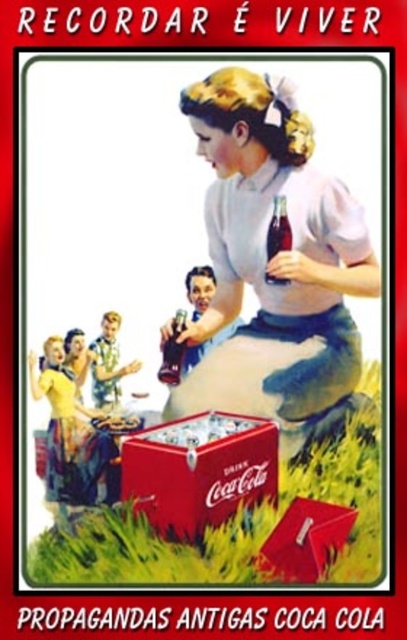
Question: Which is nearer to the yellow fabric dress at lower left?

Choices:
 (A) matte red cooler at lower center
 (B) matte white dress at center
 (C) matte red cooler at center

Answer: (A)

Question: Which point is farther to the camera?

Choices:
 (A) (273, 225)
 (B) (326, 561)

Answer: (A)

Question: Estimate the real-world distances between objects in this image. Which object is closer to the yellow fabric dress at lower left?

Choices:
 (A) translucent glass bottle at center
 (B) matte white dress at center

Answer: (B)

Question: Does yellow fabric dress at lower left appear on the right side of translucent glass bottle at center?

Choices:
 (A) no
 (B) yes

Answer: (A)

Question: Does matte red cooler at center have a smaller size compared to matte glass bottle at center?

Choices:
 (A) no
 (B) yes

Answer: (A)

Question: Is translucent glass bottle at center positioned before matte glass bottle at center?

Choices:
 (A) no
 (B) yes

Answer: (B)